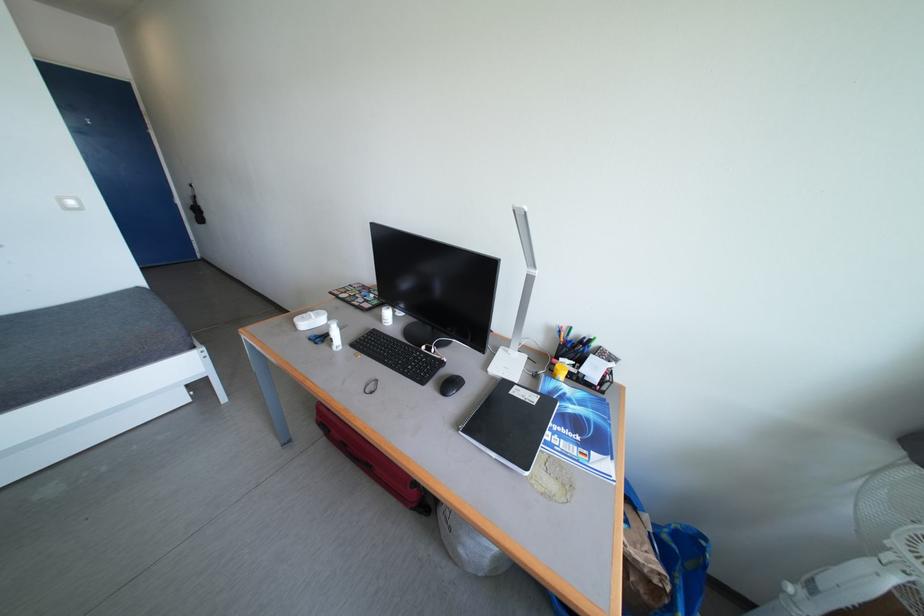
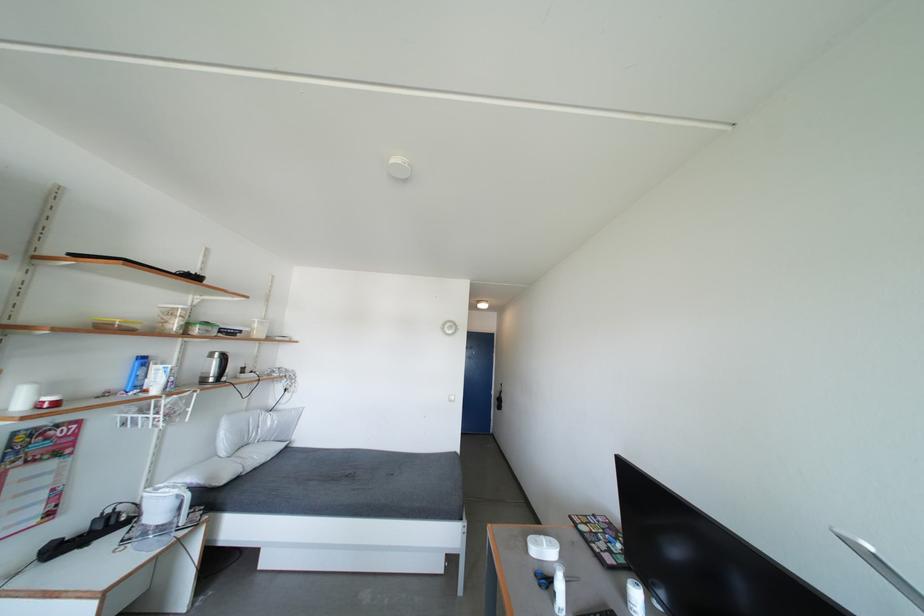
In the second image, find the point that corresponds to point 319,349 in the first image.

(541, 588)